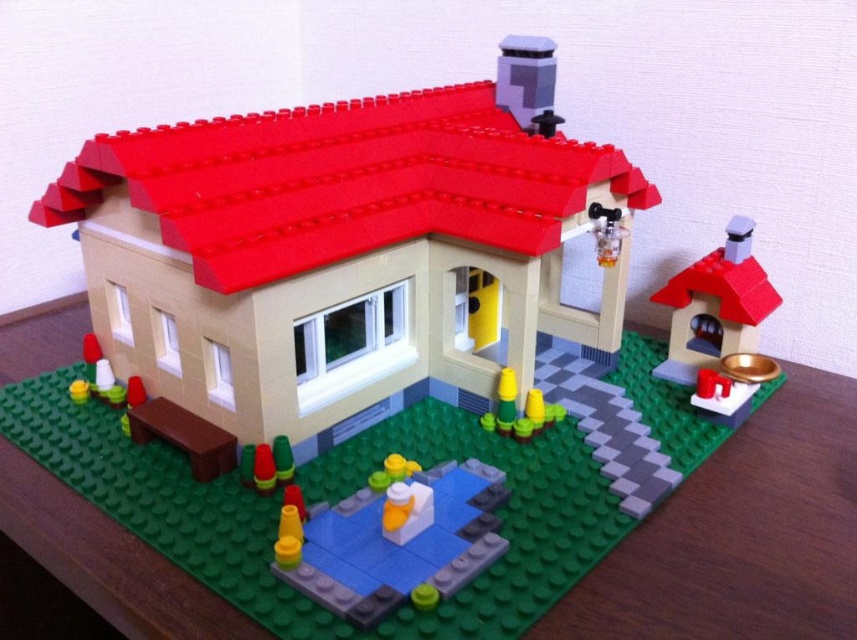
Question: Can you confirm if smooth plastic duck at center is positioned to the right of shiny gold bowl at right?

Choices:
 (A) yes
 (B) no

Answer: (B)

Question: Is smooth plastic duck at center bigger than shiny gold bowl at right?

Choices:
 (A) yes
 (B) no

Answer: (B)

Question: Among these objects, which one is farthest from the camera?

Choices:
 (A) smooth plastic duck at center
 (B) shiny gold bowl at right

Answer: (B)

Question: Which object appears closest to the camera in this image?

Choices:
 (A) smooth plastic duck at center
 (B) shiny gold bowl at right

Answer: (A)

Question: Can you confirm if smooth plastic duck at center is positioned below shiny gold bowl at right?

Choices:
 (A) no
 (B) yes

Answer: (B)